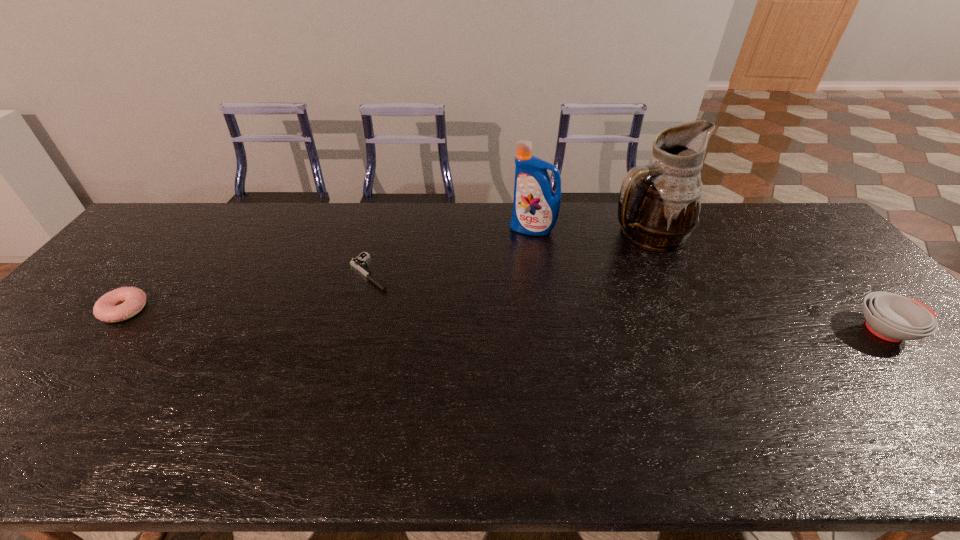
Find the location of a particular element. vacant space located 0.280m on the back of the fourth tallest object is located at coordinates (187, 235).

You are a GUI agent. You are given a task and a screenshot of the screen. Output one action in this format:
    pyautogui.click(x=<x>, y=<y>)
    Task: Click on the free space located on the front of the rightmost object
    
    Given the screenshot: What is the action you would take?
    pyautogui.click(x=949, y=399)

Locate an element on the screen. vacant area situated on the label of the fourth shortest object is located at coordinates (515, 248).

This screenshot has width=960, height=540. I want to click on vacant area situated on the label of the fourth shortest object, so click(479, 294).

At what (x,y) coordinates should I click in order to perform the action: click on free space located on the label of the fourth shortest object. Please return your answer as a coordinate pair (x, y). Image resolution: width=960 pixels, height=540 pixels. Looking at the image, I should click on (503, 262).

Where is `free region located from the spout of the pitcher`? free region located from the spout of the pitcher is located at coordinates (614, 306).

The width and height of the screenshot is (960, 540). Find the location of `free space located from the spout of the pitcher`. free space located from the spout of the pitcher is located at coordinates (612, 313).

Locate an element on the screen. vacant space positioned 0.330m from the spout of the pitcher is located at coordinates (608, 323).

Where is `vacant space located 0.100m on the front-facing side of the shortest object`? vacant space located 0.100m on the front-facing side of the shortest object is located at coordinates (403, 303).

At what (x,y) coordinates should I click in order to perform the action: click on vacant space located 0.280m on the front-facing side of the shortest object. Please return your answer as a coordinate pair (x, y). The image size is (960, 540). Looking at the image, I should click on (447, 339).